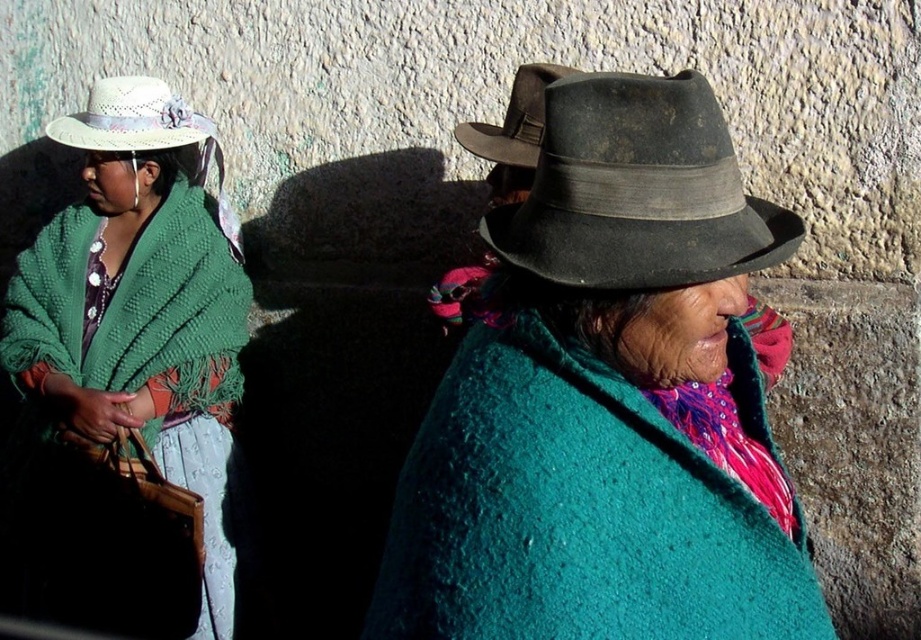
You are a photographer trying to capture both the dark gray felt fedora at center and the white straw hat at upper left in a single frame. Based on their positions, which hat will appear higher in the photo?

The white straw hat at upper left will appear higher in the photo because it is positioned above the dark gray felt fedora at center.

You are a photographer trying to capture a clear photo of the dark gray felt fedora at center and the dark brown felt cowboy hat at upper right. Which hat will appear closer in your photo?

The dark gray felt fedora at center will appear closer in your photo because it is positioned in front of the dark brown felt cowboy hat at upper right.